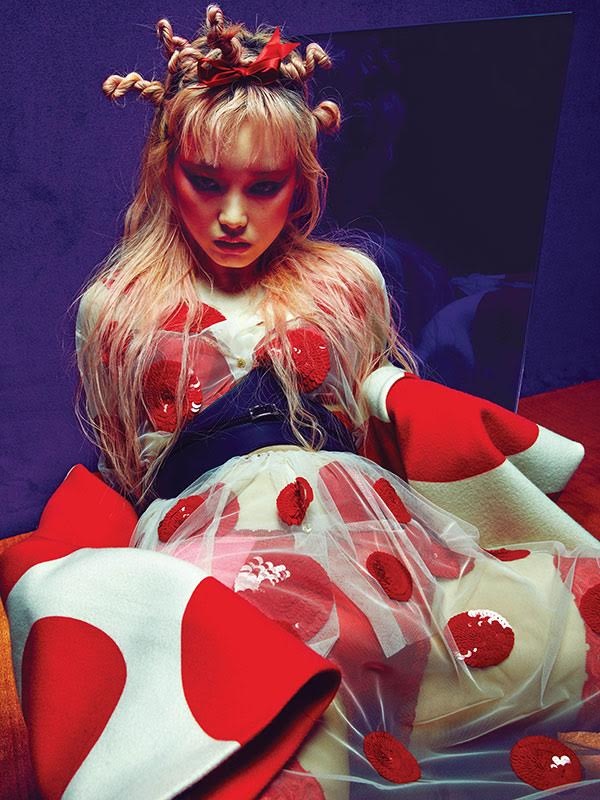
Where is `mirror`? The image size is (600, 800). mirror is located at coordinates (519, 122).